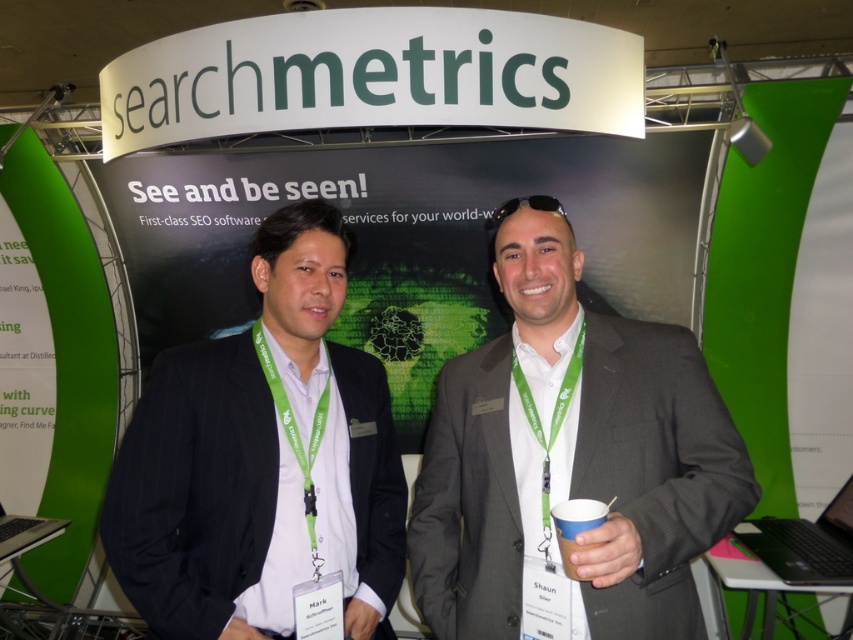
Question: Does black plastic laptop at lower right have a larger size compared to silver metallic laptop at lower left?

Choices:
 (A) no
 (B) yes

Answer: (B)

Question: Which object is positioned farthest from the blue paper cup at right?

Choices:
 (A) gray suit at center
 (B) dark gray pinstripe suit at center

Answer: (B)

Question: Which point is farther from the camera taking this photo?

Choices:
 (A) (476, 353)
 (B) (573, 566)
 (C) (254, 344)

Answer: (A)

Question: Is blue paper cup at right below silver metallic laptop at lower left?

Choices:
 (A) yes
 (B) no

Answer: (B)

Question: Which object is the closest to the dark gray pinstripe suit at center?

Choices:
 (A) blue paper cup at right
 (B) black plastic laptop at lower right
 (C) gray suit at center
 (D) silver metallic laptop at lower left

Answer: (C)

Question: Can you confirm if dark gray pinstripe suit at center is smaller than silver metallic laptop at lower left?

Choices:
 (A) yes
 (B) no

Answer: (B)